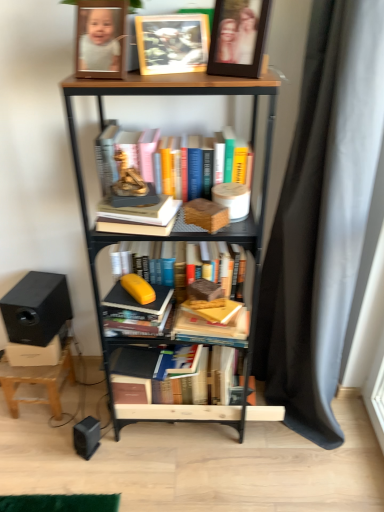
This screenshot has height=512, width=384. In order to click on vacant region in front of wooden photo frame at upper center, positioned as the 1th picture frame in left-to-right order in this screenshot , I will do `click(181, 76)`.